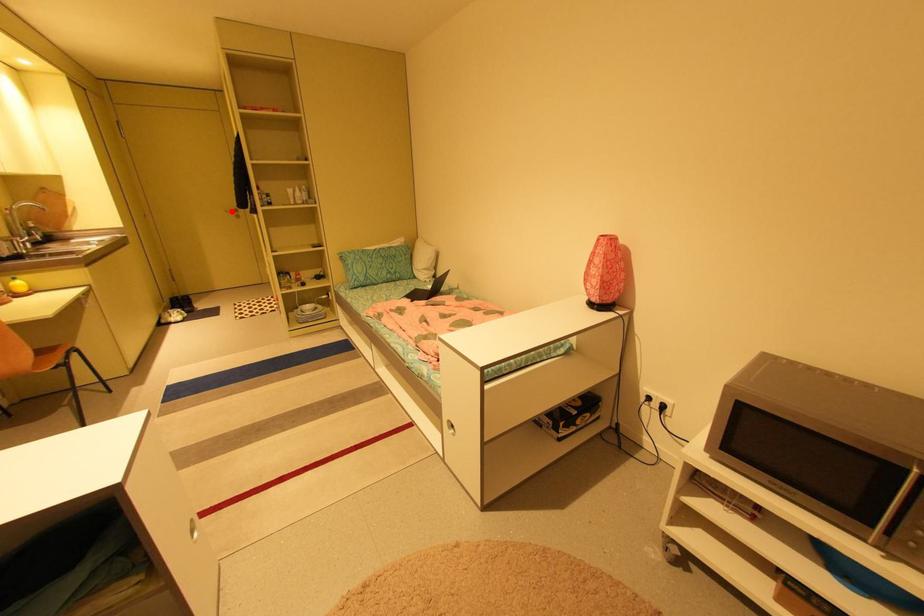
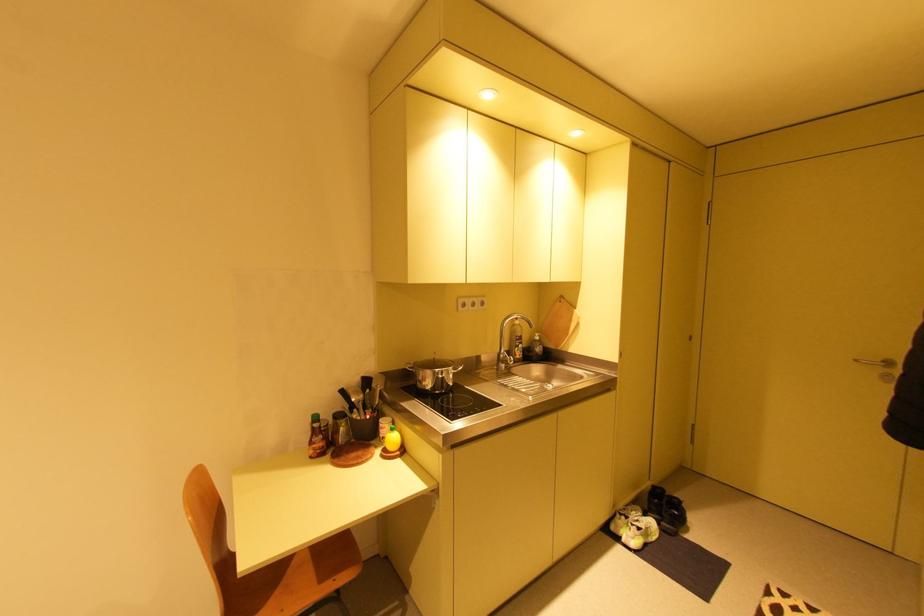
Question: I am providing you with two images of the same scene from different viewpoints. Given a red point in image1, look at the same physical point in image2. Is it:

Choices:
 (A) Closer to the viewpoint
 (B) Farther from the viewpoint

Answer: (B)